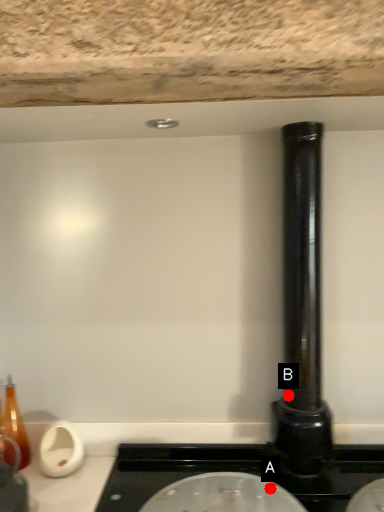
Question: Two points are circled on the image, labeled by A and B beside each circle. Which point is closer to the camera?

Choices:
 (A) A is closer
 (B) B is closer

Answer: (A)